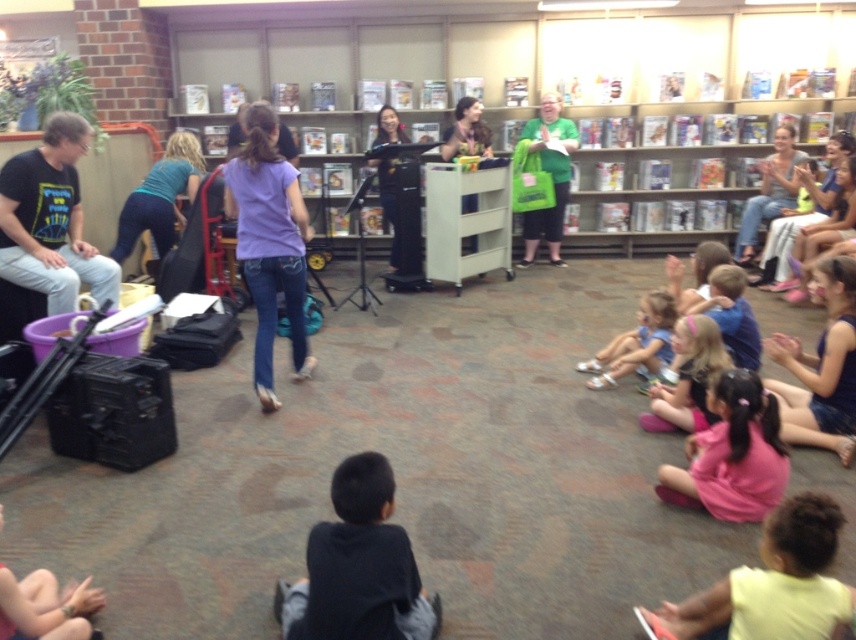
You are a photographer trying to capture a candid shot of the light yellow shirt at lower right and the purple denim jeans at center. Based on their sizes, which one would require you to move closer to get a clear photo?

The light yellow shirt at lower right has a smaller size compared to the purple denim jeans at center, so you would need to move closer to the light yellow shirt at lower right to capture it clearly.